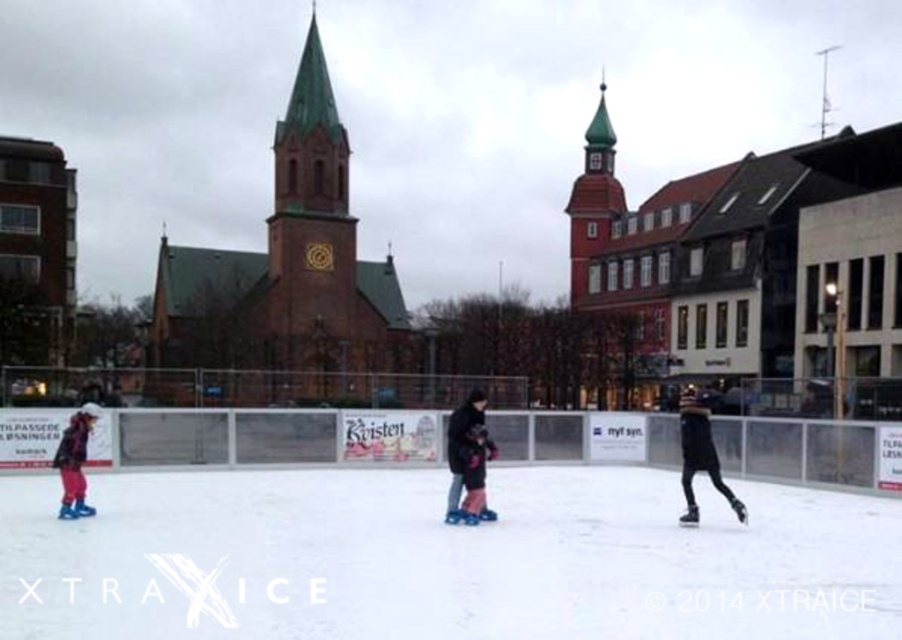
Describe the element at coordinates (443, 560) in the screenshot. Image resolution: width=902 pixels, height=640 pixels. I see `white smooth ice at center` at that location.

Describe the element at coordinates (443, 560) in the screenshot. I see `white smooth ice at center` at that location.

The width and height of the screenshot is (902, 640). Identify the location of white smooth ice at center. (443, 560).

From the picture: Is white smooth ice at center smaller than dark blue fabric jacket at center?

No.

Where is `white smooth ice at center`? white smooth ice at center is located at coordinates (443, 560).

What do you see at coordinates (443, 560) in the screenshot?
I see `white smooth ice at center` at bounding box center [443, 560].

Image resolution: width=902 pixels, height=640 pixels. In order to click on white smooth ice at center in this screenshot , I will do `click(443, 560)`.

Does dark blue fabric jacket at center appear on the left side of matte pink pants at left?

No, dark blue fabric jacket at center is not to the left of matte pink pants at left.

Does point (468, 468) come farther from viewer compared to point (72, 449)?

Yes, point (468, 468) is farther from viewer.

Find the location of a particular element. dark blue fabric jacket at center is located at coordinates (468, 460).